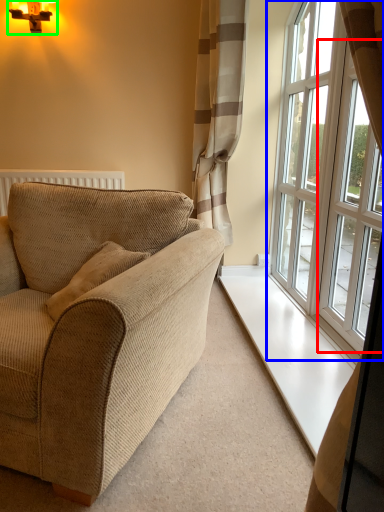
Question: Based on their relative distances, which object is nearer to window (highlighted by a red box)? Choose from window (highlighted by a blue box) and light fixture (highlighted by a green box).

Choices:
 (A) window
 (B) light fixture

Answer: (A)